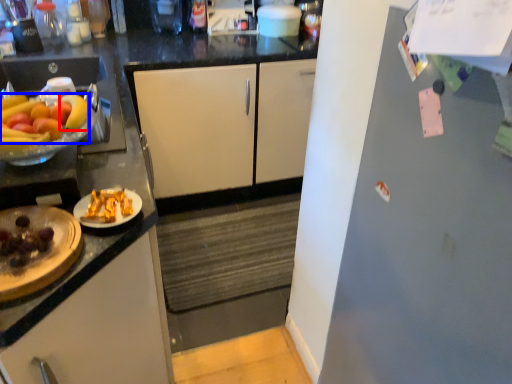
Question: Which object is further to the camera taking this photo, banana (highlighted by a red box) or grapefruit (highlighted by a blue box)?

Choices:
 (A) banana
 (B) grapefruit

Answer: (A)